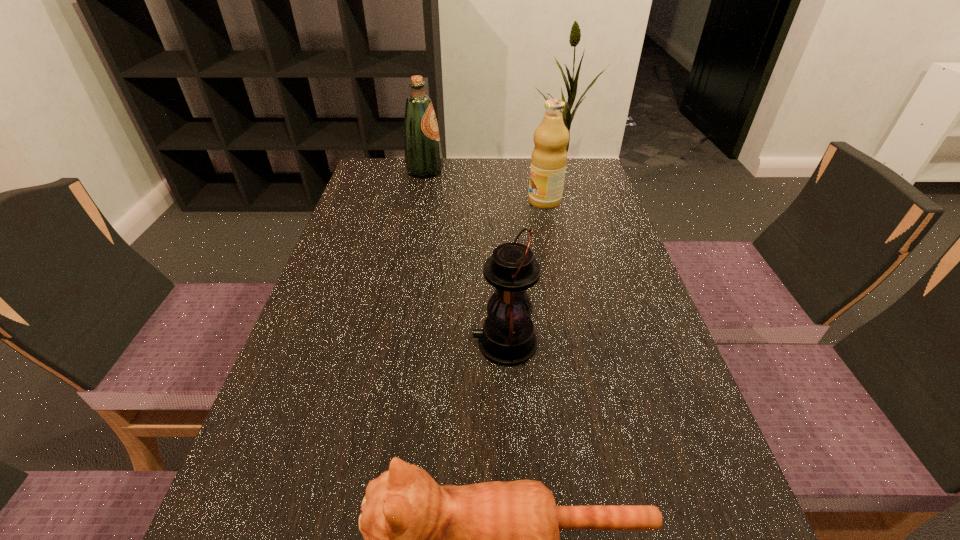
Identify some points in free space located 0.110m above the lantern, indicating its light source. Please provide its 2D coordinates. Your answer should be formatted as a tuple, i.e. [(x, y)], where the tuple contains the x and y coordinates of a point satisfying the conditions above.

[(417, 343)]

Locate several points in vacant space located above the lantern, indicating its light source. Please provide its 2D coordinates. Your answer should be formatted as a tuple, i.e. [(x, y)], where the tuple contains the x and y coordinates of a point satisfying the conditions above.

[(314, 343)]

Locate an element on the screen. The height and width of the screenshot is (540, 960). object situated at the left edge is located at coordinates (423, 156).

Identify the location of object that is at the right edge. (549, 157).

The height and width of the screenshot is (540, 960). Find the location of `object that is at the far left corner`. object that is at the far left corner is located at coordinates (423, 156).

At what (x,y) coordinates should I click in order to perform the action: click on object at the far right corner. Please return your answer as a coordinate pair (x, y). Image resolution: width=960 pixels, height=540 pixels. Looking at the image, I should click on (549, 157).

Where is `vacant area at the far edge of the desktop`? Image resolution: width=960 pixels, height=540 pixels. vacant area at the far edge of the desktop is located at coordinates (468, 191).

The height and width of the screenshot is (540, 960). Find the location of `vacant space at the left edge of the desktop`. vacant space at the left edge of the desktop is located at coordinates (391, 221).

This screenshot has width=960, height=540. I want to click on free space at the right edge of the desktop, so click(x=642, y=310).

Where is `vacant area at the far right corner of the desktop`? Image resolution: width=960 pixels, height=540 pixels. vacant area at the far right corner of the desktop is located at coordinates (585, 164).